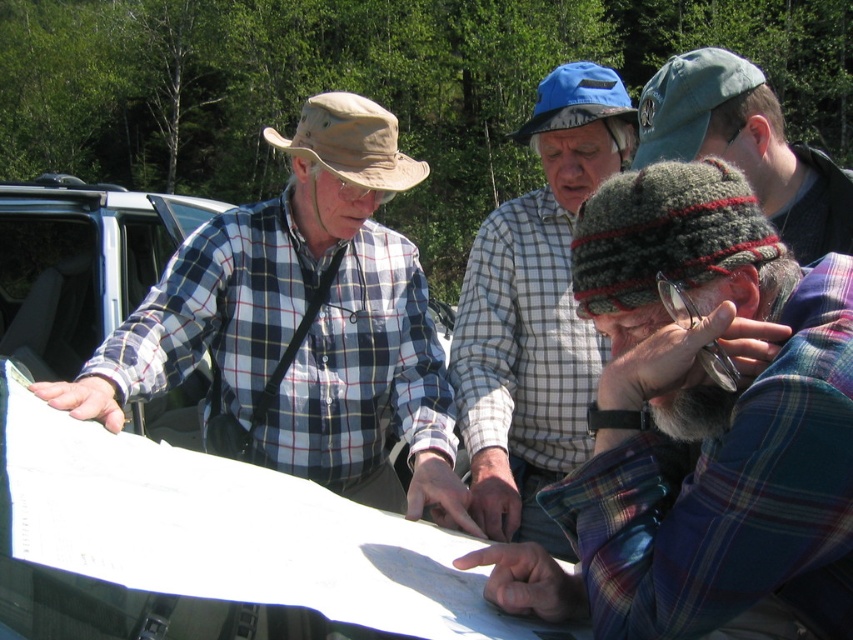
Does point (756, 468) come closer to viewer compared to point (173, 298)?

Yes, it is.

Who is more forward, (573, 520) or (132, 371)?

Positioned in front is point (573, 520).

Where is `plaid flannel shirt at center`? plaid flannel shirt at center is located at coordinates (699, 424).

Does plaid flannel shirt at center appear over knitted wool hat at center?

Actually, plaid flannel shirt at center is below knitted wool hat at center.

Is point (639, 378) in front of point (641, 106)?

Yes, it is.

Find the location of a particular element. This screenshot has height=640, width=853. plaid flannel shirt at center is located at coordinates (699, 424).

Is plaid shirt at center bigger than knitted wool hat at center?

Actually, plaid shirt at center might be smaller than knitted wool hat at center.

Who is more forward, [593,385] or [825,161]?

Point [825,161]

Between point (498, 538) and point (677, 58), which one is positioned in front?

Point (677, 58) is in front.

Identify the location of plaid shirt at center. The width and height of the screenshot is (853, 640). (535, 310).